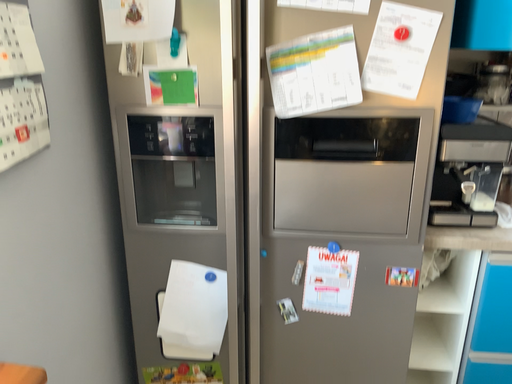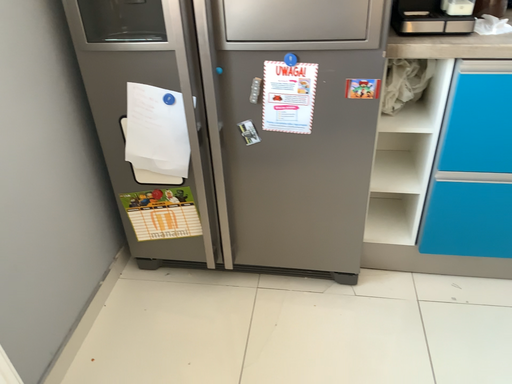
Question: Which way did the camera rotate in the video?

Choices:
 (A) rotated downward
 (B) rotated upward

Answer: (A)